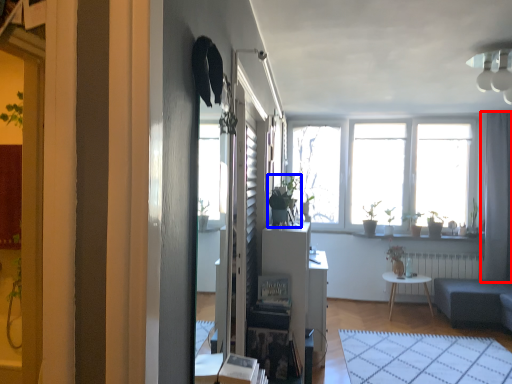
Question: Which of the following is the farthest to the observer, curtain (highlighted by a red box) or houseplant (highlighted by a blue box)?

Choices:
 (A) curtain
 (B) houseplant

Answer: (A)